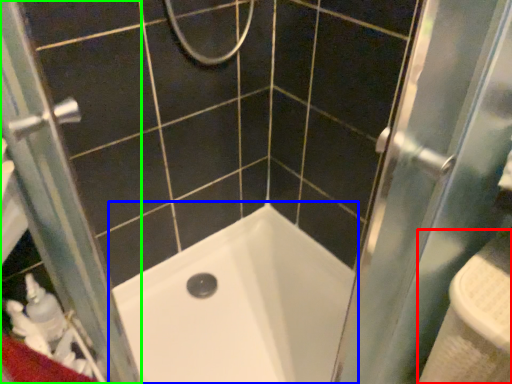
Question: Estimate the real-world distances between objects in this image. Which object is farther from sink (highlighted by a red box), bathtub (highlighted by a blue box) or screen door (highlighted by a green box)?

Choices:
 (A) bathtub
 (B) screen door

Answer: (B)